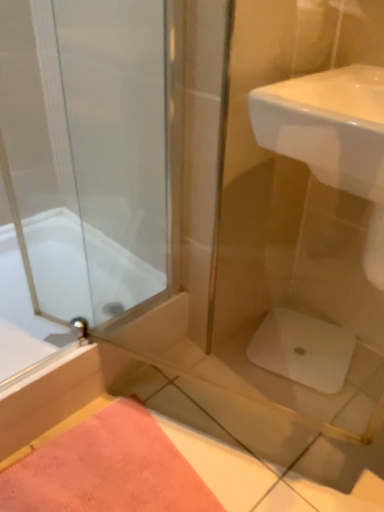
Question: From the image's perspective, is white glossy sink at upper right above or below pink fabric bath mat at lower left?

Choices:
 (A) below
 (B) above

Answer: (B)

Question: In terms of width, does white glossy sink at upper right look wider or thinner when compared to pink fabric bath mat at lower left?

Choices:
 (A) thin
 (B) wide

Answer: (A)

Question: Based on their relative distances, which object is nearer to the pink fabric bath mat at lower left?

Choices:
 (A) white glossy sink at upper right
 (B) white glossy bathtub at left

Answer: (B)

Question: Estimate the real-world distances between objects in this image. Which object is closer to the white glossy sink at upper right?

Choices:
 (A) white glossy bathtub at left
 (B) pink fabric bath mat at lower left

Answer: (A)